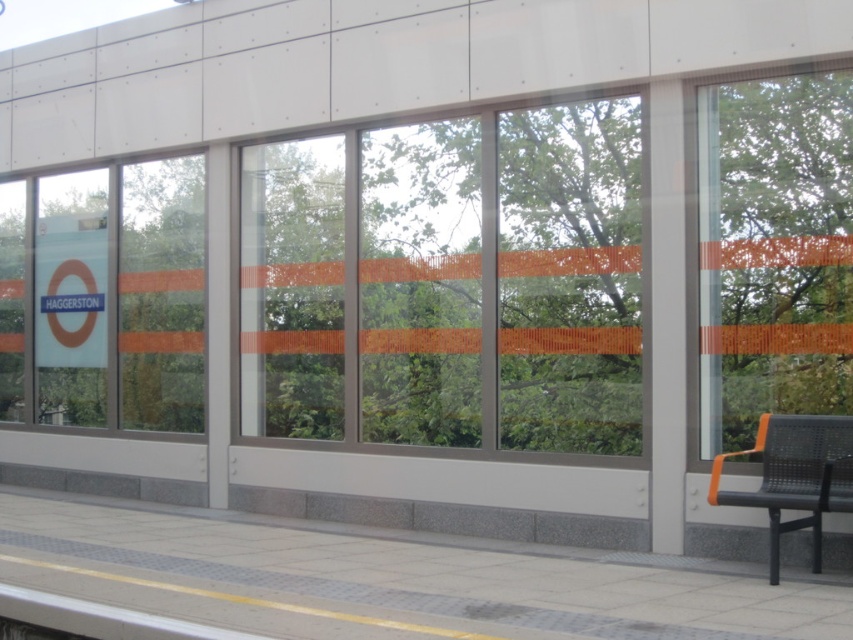
Is matte glass window at left taller than black metal bench at right?

Yes.

Which is behind, point (96, 362) or point (759, 492)?

The point (96, 362) is behind.

Locate an element on the screen. matte glass window at left is located at coordinates (120, 296).

Is point (700, 291) positioned after point (712, 496)?

Yes, it is.

Does transparent glass window at right have a larger size compared to black metal bench at right?

Correct, transparent glass window at right is larger in size than black metal bench at right.

Is point (787, 260) positioned in front of point (799, 481)?

No, it is behind (799, 481).

You are a GUI agent. You are given a task and a screenshot of the screen. Output one action in this format:
    pyautogui.click(x=<x>, y=<y>)
    Task: Click on the transparent glass window at right
    
    Given the screenshot: What is the action you would take?
    pyautogui.click(x=773, y=252)

Can you confirm if transparent glass window at center is thinner than transparent glass window at right?

No, transparent glass window at center is not thinner than transparent glass window at right.

Who is higher up, transparent glass window at center or transparent glass window at right?

Positioned higher is transparent glass window at right.

Is point (254, 161) in front of point (746, 417)?

No, it is behind (746, 417).

Where is `transparent glass window at center`? The image size is (853, 640). transparent glass window at center is located at coordinates (450, 284).